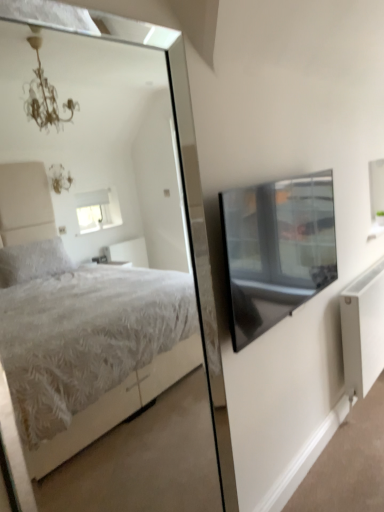
Question: Is transparent glass window screen at upper right wider or thinner than white textured bed at center?

Choices:
 (A) wide
 (B) thin

Answer: (A)

Question: From the image's perspective, is transparent glass window screen at upper right positioned above or below white textured bed at center?

Choices:
 (A) above
 (B) below

Answer: (A)

Question: Estimate the real-world distances between objects in this image. Which object is closer to the white matte radiator at lower right?

Choices:
 (A) transparent glass window screen at upper right
 (B) white textured bed at center

Answer: (A)

Question: Considering the real-world distances, which object is closest to the white textured bed at center?

Choices:
 (A) white matte radiator at lower right
 (B) transparent glass window screen at upper right

Answer: (A)